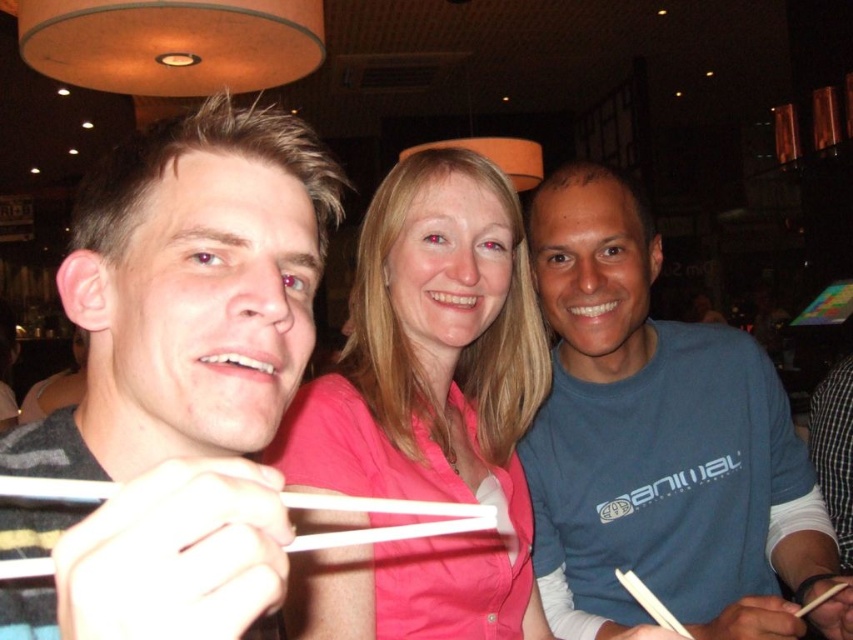
What do you see at coordinates (189, 292) in the screenshot? I see `gray striped shirt at left` at bounding box center [189, 292].

You are a GUI agent. You are given a task and a screenshot of the screen. Output one action in this format:
    pyautogui.click(x=<x>, y=<y>)
    Task: Click on the gray striped shirt at left
    The width and height of the screenshot is (853, 640).
    Given the screenshot: What is the action you would take?
    pyautogui.click(x=189, y=292)

Can you confirm if gray striped shirt at left is thinner than blue cotton shirt at center?

Yes.

Is gray striped shirt at left behind blue cotton shirt at center?

No, it is not.

Does point (229, 394) come farther from viewer compared to point (548, 580)?

No, (229, 394) is closer to viewer.

The height and width of the screenshot is (640, 853). Find the location of `gray striped shirt at left`. gray striped shirt at left is located at coordinates (189, 292).

Is gray striped shirt at left taller than white plastic chopsticks at lower left?

Correct, gray striped shirt at left is much taller as white plastic chopsticks at lower left.

How distant is gray striped shirt at left from white plastic chopsticks at lower left?

gray striped shirt at left is 10.59 centimeters from white plastic chopsticks at lower left.

From the picture: Measure the distance between point (79,406) and camera.

The distance of point (79,406) from camera is 23.89 inches.

Where is `gray striped shirt at left`? gray striped shirt at left is located at coordinates (189, 292).